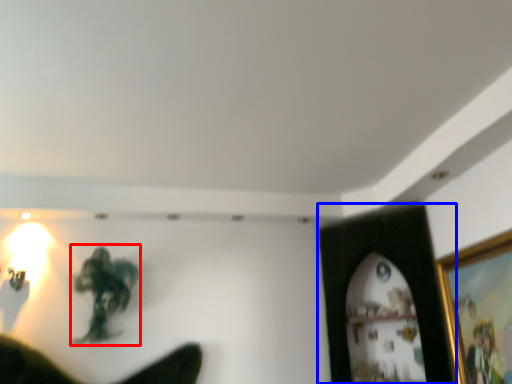
Question: Among these objects, which one is farthest to the camera, person (highlighted by a red box) or picture frame (highlighted by a blue box)?

Choices:
 (A) person
 (B) picture frame

Answer: (A)